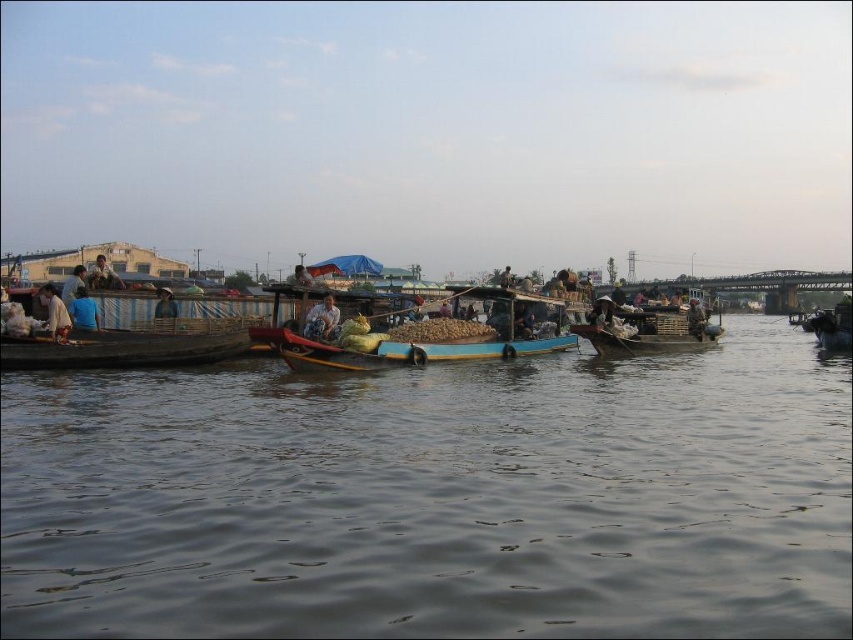
Looking at this image, does brown wooden boats at center have a greater height compared to light brown wooden boat at left?

Correct, brown wooden boats at center is much taller as light brown wooden boat at left.

Is brown wooden boats at center above light brown wooden boat at left?

No, brown wooden boats at center is not above light brown wooden boat at left.

Consider the image. Who is more forward, (582, 435) or (61, 323)?

Positioned in front is point (582, 435).

Locate an element on the screen. This screenshot has height=640, width=853. brown wooden boats at center is located at coordinates (434, 497).

Who is positioned more to the right, brown woven hat at center or light blue fabric at left?

From the viewer's perspective, brown woven hat at center appears more on the right side.

Is brown woven hat at center shorter than light blue fabric at left?

Indeed, brown woven hat at center has a lesser height compared to light blue fabric at left.

Measure the distance between point [161,291] and camera.

102.32 meters

You are a GUI agent. You are given a task and a screenshot of the screen. Output one action in this format:
    pyautogui.click(x=<x>, y=<y>)
    Task: Click on the brown woven hat at center
    The height and width of the screenshot is (640, 853).
    Given the screenshot: What is the action you would take?
    pyautogui.click(x=165, y=304)

Is light brown fabric shirt at left positioned in front of light blue fabric at left?

No.

Who is higher up, light brown fabric shirt at left or light blue fabric at left?

light brown fabric shirt at left is higher up.

Which is behind, point (96, 278) or point (67, 284)?

The point (96, 278) is more distant.

This screenshot has width=853, height=640. I want to click on light brown fabric shirt at left, so click(102, 275).